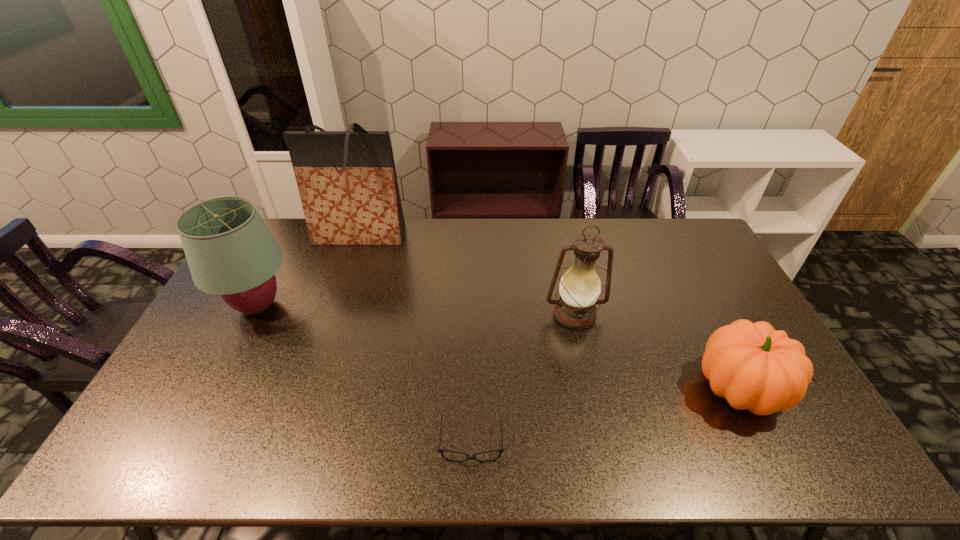
The image size is (960, 540). In order to click on free location that satisfies the following two spatial constraints: 1. on the front-facing side of the shopping bag; 2. on the left side of the second object from right to left in this screenshot , I will do `click(332, 315)`.